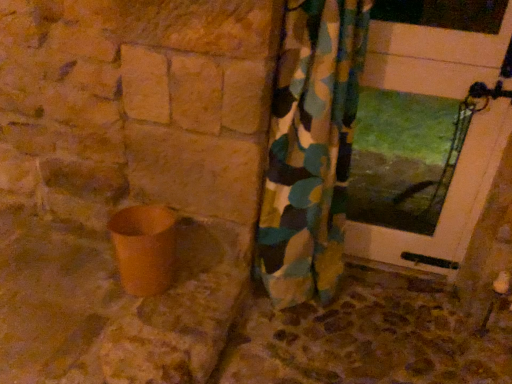
This screenshot has width=512, height=384. Identify the location of camouflage fabric curtain at center. (311, 149).

Describe the element at coordinates (368, 338) in the screenshot. I see `brown stone concrete at lower center` at that location.

Locate an element on the screen. white glossy door at upper right is located at coordinates (443, 205).

This screenshot has width=512, height=384. Describe the element at coordinates (144, 248) in the screenshot. I see `matte brown pot at lower left` at that location.

Identify the location of camouflage fabric curtain at center. Image resolution: width=512 pixels, height=384 pixels. (311, 149).

From a real-world perspective, between matte brown pot at lower left and brown stone concrete at lower center, who is vertically lower?

brown stone concrete at lower center.

Is matte brown pot at lower left closer to the viewer compared to brown stone concrete at lower center?

That is False.

Which object is positioned more to the left, matte brown pot at lower left or brown stone concrete at lower center?

matte brown pot at lower left is more to the left.

Considering the sizes of objects matte brown pot at lower left and brown stone concrete at lower center in the image provided, who is thinner, matte brown pot at lower left or brown stone concrete at lower center?

matte brown pot at lower left.

Can you confirm if camouflage fabric curtain at center is thinner than white glossy door at upper right?

In fact, camouflage fabric curtain at center might be wider than white glossy door at upper right.

Are camouflage fabric curtain at center and white glossy door at upper right located far from each other?

No.

Does point (286, 140) come closer to viewer compared to point (414, 27)?

No.

From a real-world perspective, which object stands above the other?

From a 3D spatial view, white glossy door at upper right is above.

Based on their sizes in the image, would you say white glossy door at upper right is bigger or smaller than brown stone concrete at lower center?

Clearly, white glossy door at upper right is smaller in size than brown stone concrete at lower center.

From a real-world perspective, is white glossy door at upper right physically located above or below brown stone concrete at lower center?

In terms of real-world spatial position, white glossy door at upper right is above brown stone concrete at lower center.

Does white glossy door at upper right have a greater width compared to brown stone concrete at lower center?

No, white glossy door at upper right is not wider than brown stone concrete at lower center.

From a real-world perspective, is camouflage fabric curtain at center located higher than brown stone concrete at lower center?

Yes.

The width and height of the screenshot is (512, 384). I want to click on concrete located below the camouflage fabric curtain at center (from the image's perspective), so click(x=368, y=338).

Looking at this image, which object is thinner, camouflage fabric curtain at center or brown stone concrete at lower center?

With smaller width is camouflage fabric curtain at center.

Is brown stone concrete at lower center positioned with its back to camouflage fabric curtain at center?

No, brown stone concrete at lower center is not facing away from camouflage fabric curtain at center.

You are a GUI agent. You are given a task and a screenshot of the screen. Output one action in this format:
    pyautogui.click(x=<x>, y=<y>)
    Task: Click on the concrete that is on the right side of camouflage fabric curtain at center
    This screenshot has width=512, height=384.
    Given the screenshot: What is the action you would take?
    pyautogui.click(x=368, y=338)

Are brown stone concrete at lower center and camouflage fabric curtain at center far apart?

No.

Which is correct: brown stone concrete at lower center is inside camouflage fabric curtain at center, or outside of it?

brown stone concrete at lower center lies outside camouflage fabric curtain at center.

Are matte brown pot at lower left and white glossy door at upper right far apart?

matte brown pot at lower left is positioned a significant distance from white glossy door at upper right.

Between matte brown pot at lower left and white glossy door at upper right, which one has smaller size?

Smaller between the two is matte brown pot at lower left.

How many degrees apart are the facing directions of matte brown pot at lower left and white glossy door at upper right?

They differ by 3.68 degrees in their facing directions.

Which object is further away from the camera, white glossy door at upper right or camouflage fabric curtain at center?

white glossy door at upper right is further away from the camera.

From the image's perspective, is white glossy door at upper right positioned above or below camouflage fabric curtain at center?

From the image's perspective, white glossy door at upper right appears above camouflage fabric curtain at center.

Is point (459, 167) more distant than point (295, 105)?

Yes, point (459, 167) is behind point (295, 105).

Is white glossy door at upper right directly adjacent to camouflage fabric curtain at center?

white glossy door at upper right and camouflage fabric curtain at center are not in contact.

Find the location of a particular element. The height and width of the screenshot is (384, 512). concrete on the right of the matte brown pot at lower left is located at coordinates (368, 338).

Where is `curtain in front of the white glossy door at upper right`? Image resolution: width=512 pixels, height=384 pixels. curtain in front of the white glossy door at upper right is located at coordinates (311, 149).

Based on their spatial positions, is camouflage fabric curtain at center or white glossy door at upper right further from matte brown pot at lower left?

white glossy door at upper right lies further to matte brown pot at lower left than the other object.

From the image, which object appears to be nearer to matte brown pot at lower left, camouflage fabric curtain at center or brown stone concrete at lower center?

camouflage fabric curtain at center.

Which object lies further to the anchor point brown stone concrete at lower center, white glossy door at upper right or camouflage fabric curtain at center?

white glossy door at upper right is further to brown stone concrete at lower center.

Which object lies further to the anchor point white glossy door at upper right, brown stone concrete at lower center or camouflage fabric curtain at center?

Among the two, brown stone concrete at lower center is located further to white glossy door at upper right.

From the image, which object appears to be nearer to brown stone concrete at lower center, matte brown pot at lower left or white glossy door at upper right?

white glossy door at upper right lies closer to brown stone concrete at lower center than the other object.

Which object lies nearer to the anchor point matte brown pot at lower left, brown stone concrete at lower center or camouflage fabric curtain at center?

Based on the image, camouflage fabric curtain at center appears to be nearer to matte brown pot at lower left.

Estimate the real-world distances between objects in this image. Which object is closer to brown stone concrete at lower center, camouflage fabric curtain at center or matte brown pot at lower left?

Based on the image, camouflage fabric curtain at center appears to be nearer to brown stone concrete at lower center.

Consider the image. When comparing their distances from camouflage fabric curtain at center, does brown stone concrete at lower center or matte brown pot at lower left seem further?

matte brown pot at lower left.

At what (x,y) coordinates should I click in order to perform the action: click on curtain between white glossy door at upper right and brown stone concrete at lower center in the vertical direction. Please return your answer as a coordinate pair (x, y). Looking at the image, I should click on tap(311, 149).

The height and width of the screenshot is (384, 512). I want to click on curtain between matte brown pot at lower left and brown stone concrete at lower center, so click(311, 149).

This screenshot has width=512, height=384. I want to click on concrete between matte brown pot at lower left and white glossy door at upper right from left to right, so click(368, 338).

Locate an element on the screen. curtain between matte brown pot at lower left and white glossy door at upper right from left to right is located at coordinates (311, 149).